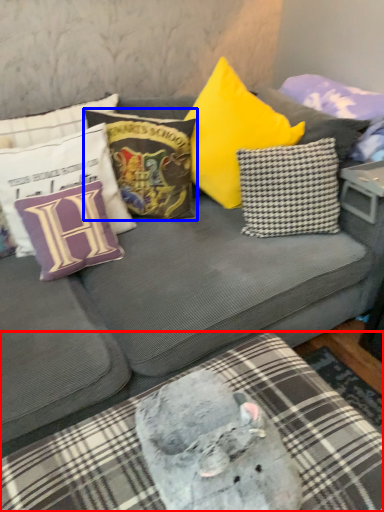
Question: Which of the following is the closest to the observer, bedding (highlighted by a red box) or pillow (highlighted by a blue box)?

Choices:
 (A) bedding
 (B) pillow

Answer: (A)